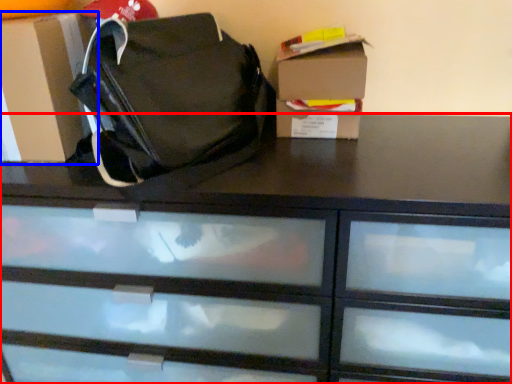
Question: Among these objects, which one is nearest to the camera, chest of drawers (highlighted by a red box) or cardboard box (highlighted by a blue box)?

Choices:
 (A) chest of drawers
 (B) cardboard box

Answer: (A)